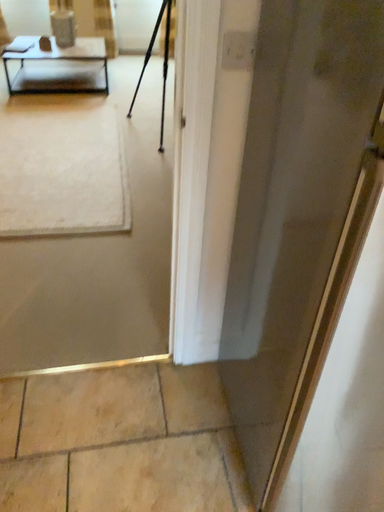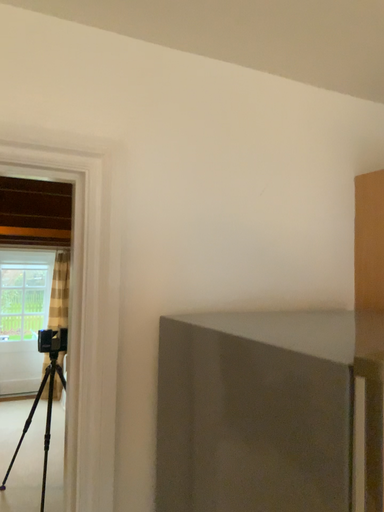
Question: Which way did the camera rotate in the video?

Choices:
 (A) rotated downward
 (B) rotated upward

Answer: (B)